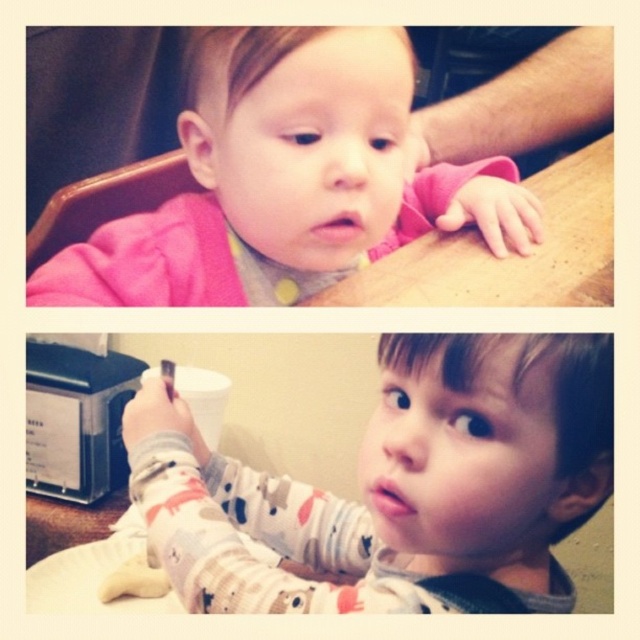
What is located at the point with coordinates (397, 484)?

The point at coordinates (397, 484) indicates printed cotton pajamas at center.

You are organizing a photo album and notice two images. In the first photo, there is a baby in a pink long sleeved shirt and bib at the wooden table. In the second photo, there is a toddler in printed cotton pajamas at center. Which child is wearing clothing with patterns?

The toddler in the printed cotton pajamas at center is wearing clothing with patterns.